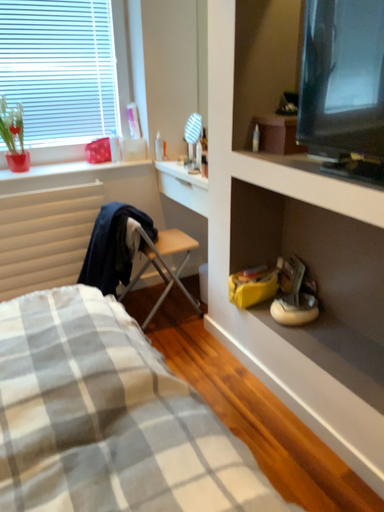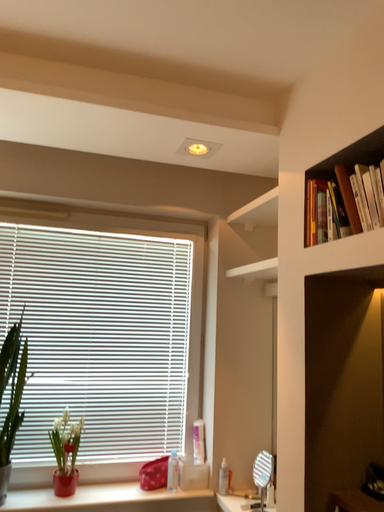
Question: How did the camera likely rotate when shooting the video?

Choices:
 (A) rotated left
 (B) rotated right

Answer: (A)